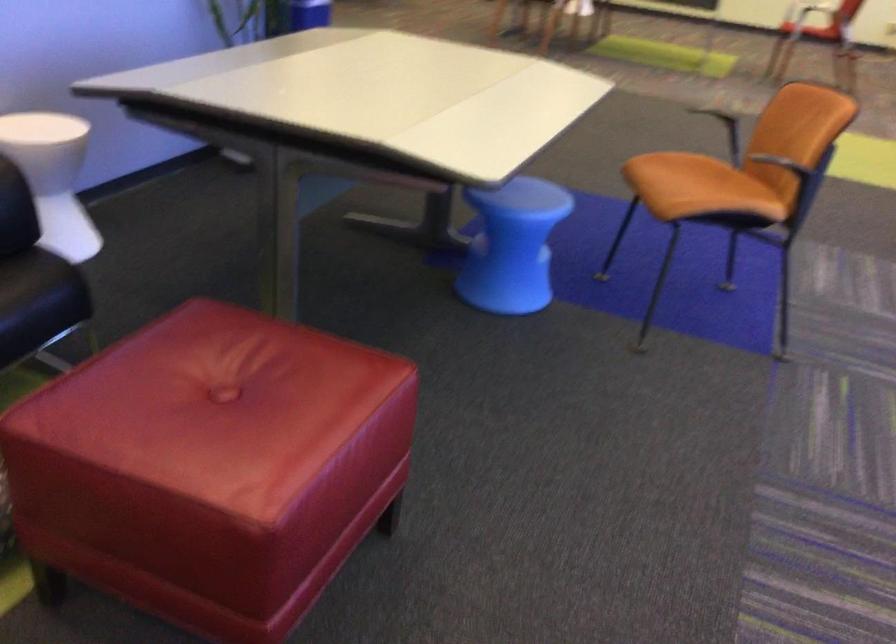
The width and height of the screenshot is (896, 644). Describe the element at coordinates (711, 173) in the screenshot. I see `the orange chair sitting surface` at that location.